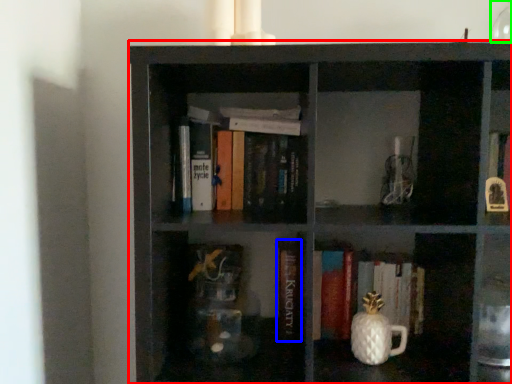
Question: Estimate the real-world distances between objects in this image. Which object is farther from shelf (highlighted by a red box), book (highlighted by a blue box) or glass vase (highlighted by a green box)?

Choices:
 (A) book
 (B) glass vase

Answer: (B)